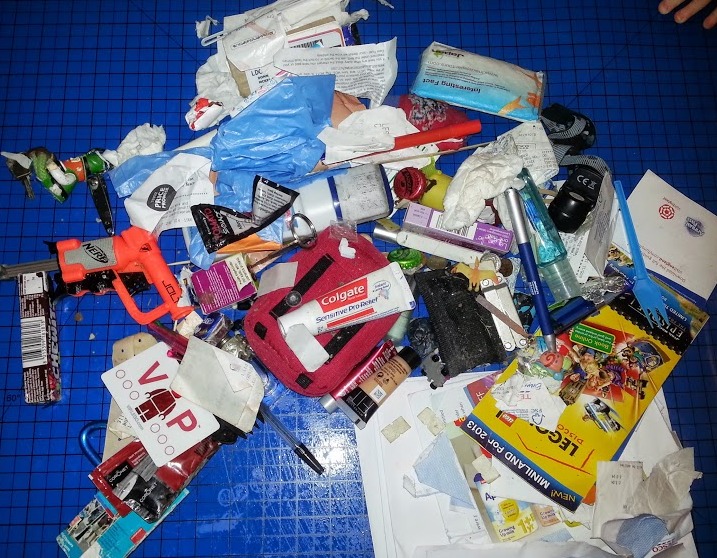
I want to click on blue mat, so click(x=292, y=521).